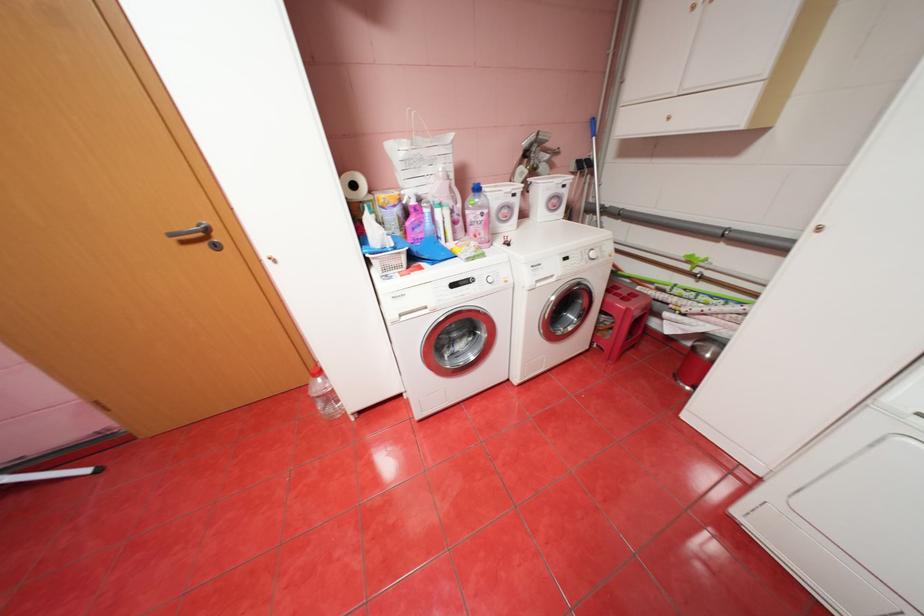
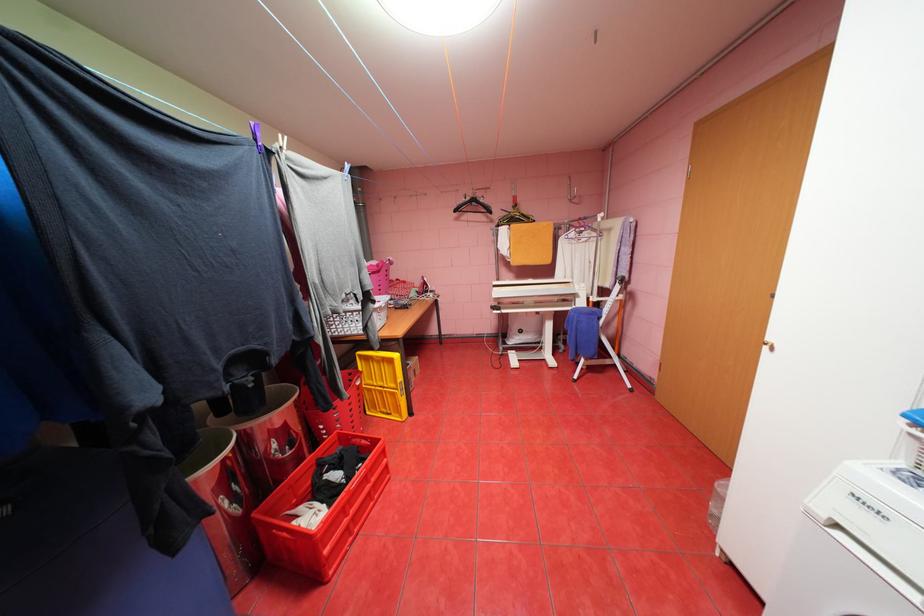
Locate, in the second image, the point that corresponds to point (409, 315) in the first image.

(845, 525)